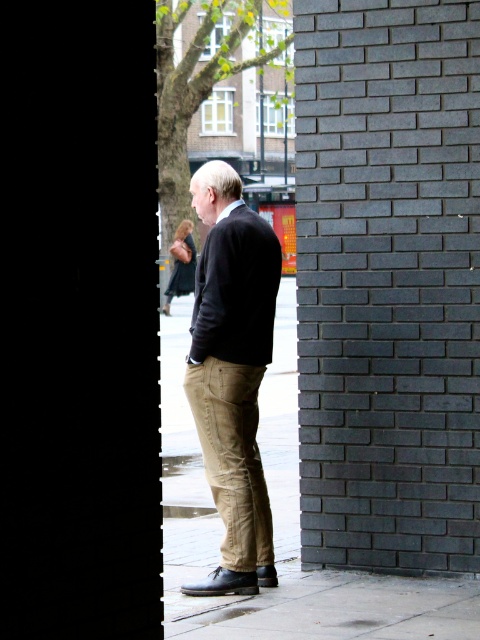
You are a fashion designer analyzing the outfit of a man in an urban setting. The man is standing in the rain, and you notice his dark brown leather shoes at center and khaki cotton pants at center. Which item of clothing is taller in the image?

The dark brown leather shoes at center are much taller than the khaki cotton pants at center in the image.

You are standing in the foreground of the image, looking through the narrow, dark framed opening. There is a point marked at coordinates (387, 284). What object does this point correspond to?

The point at coordinates (387, 284) corresponds to the dark gray brick wall at right.

You are standing at the point closer to the entrance in the scene. There are two points marked in the image, one at coordinates point (300, 60) and another at point (195, 424). Which point is farther away from you?

Point (300, 60) is behind point (195, 424), so the point farther away from you is point (300, 60).